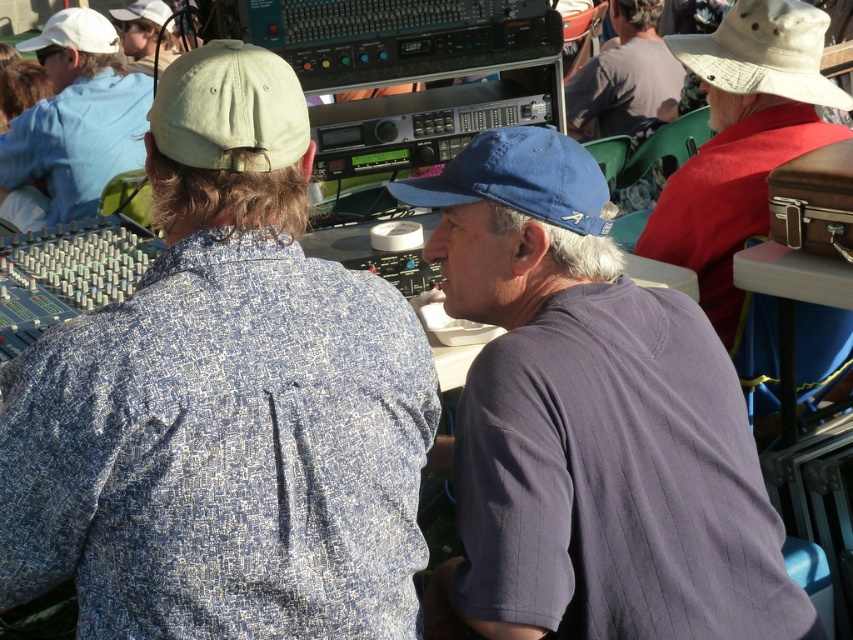
Question: Which object appears farthest from the camera in this image?

Choices:
 (A) white fabric baseball cap at upper left
 (B) light brown leather jacket at upper right
 (C) white matte cap at upper left
 (D) light gray fabric baseball cap at upper left

Answer: (A)

Question: Which point is farther from the camera taking this photo?

Choices:
 (A) (581, 100)
 (B) (770, 573)
 (C) (138, 8)

Answer: (C)

Question: Which point appears farthest from the camera in this image?

Choices:
 (A) (158, 4)
 (B) (561, 148)

Answer: (A)

Question: Is brown leather suitcase at upper right above white matte cap at upper left?

Choices:
 (A) no
 (B) yes

Answer: (A)

Question: Where is dark blue fabric shirt at center located in relation to light brown leather jacket at upper right in the image?

Choices:
 (A) below
 (B) above

Answer: (A)

Question: Is white matte cap at upper left to the right of light gray fabric baseball cap at upper left from the viewer's perspective?

Choices:
 (A) no
 (B) yes

Answer: (A)